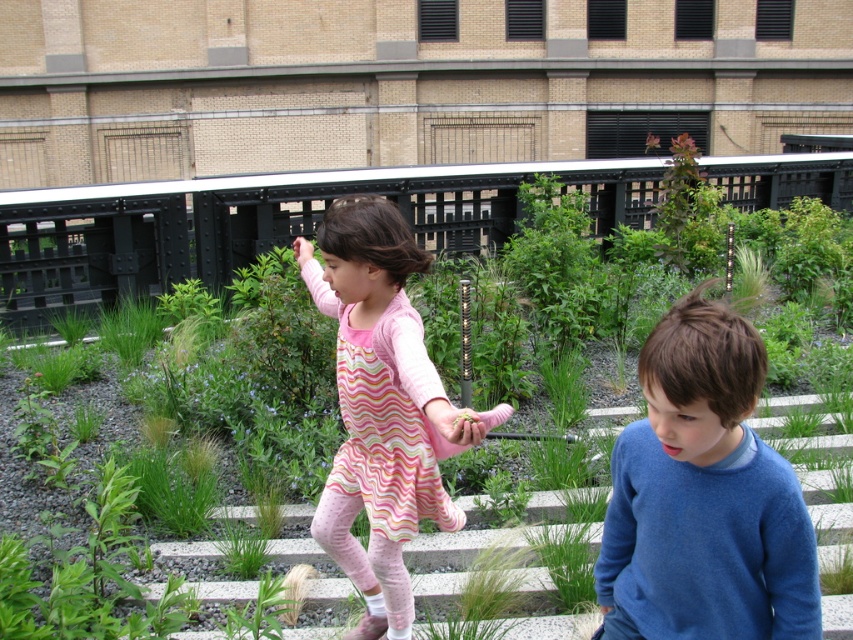
Measure the distance between blue cotton sweater at lower right and pink striped dress at center.

25.58 inches

Does blue cotton sweater at lower right have a lesser width compared to pink striped dress at center?

Indeed, blue cotton sweater at lower right has a lesser width compared to pink striped dress at center.

Between point (759, 445) and point (450, 422), which one is positioned in front?

Point (759, 445) is more forward.

Identify the location of blue cotton sweater at lower right. This screenshot has width=853, height=640. click(704, 497).

Which of these two, green grass at center or pink striped dress at center, stands shorter?

pink striped dress at center

Does green grass at center have a lesser width compared to pink striped dress at center?

No.

Locate an element on the screen. The height and width of the screenshot is (640, 853). green grass at center is located at coordinates (262, 221).

Who is more forward, [706,170] or [500,538]?

Point [500,538] is in front.

Can you confirm if green grass at center is positioned below white concrete stairs at center?

No.

Find the location of a particular element. This screenshot has width=853, height=640. green grass at center is located at coordinates (262, 221).

Identify the location of green grass at center. The image size is (853, 640). (262, 221).